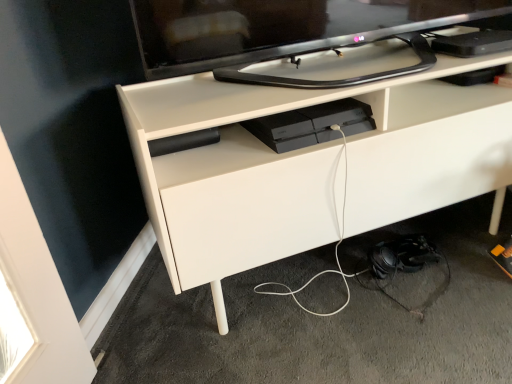
The image size is (512, 384). What are the coordinates of `free spot above satin black console at center (from a real-world perspective)` in the screenshot? It's located at (305, 115).